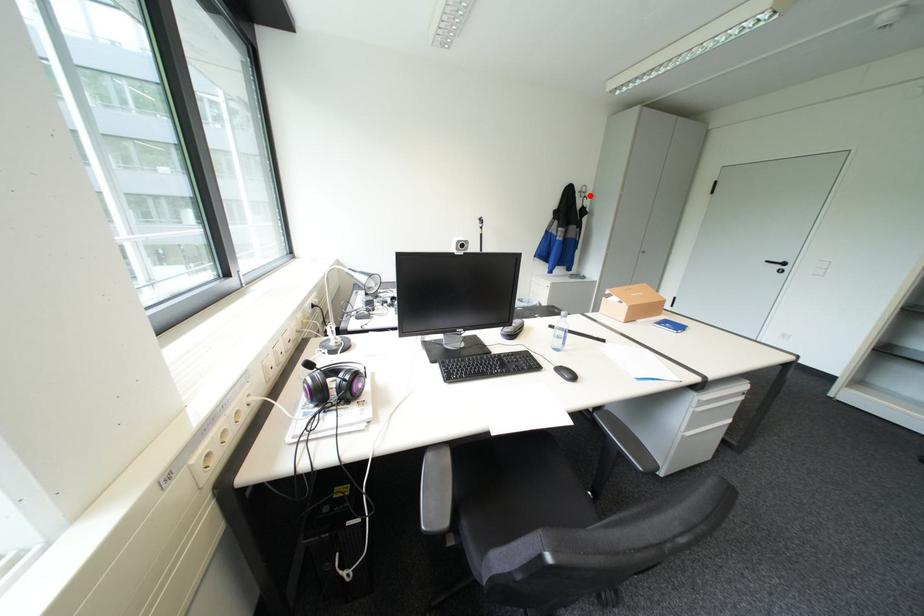
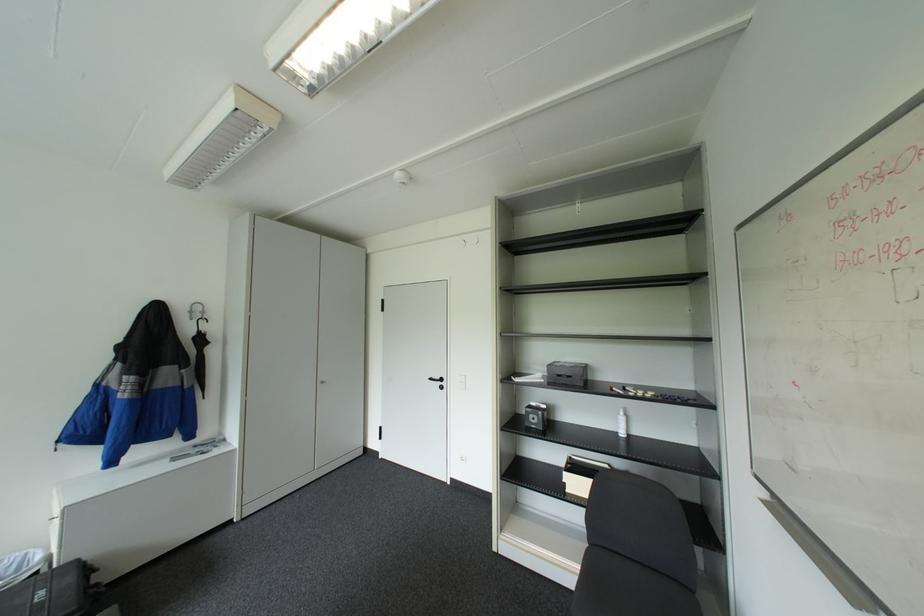
Question: I am providing you with two images of the same scene from different viewpoints. A red point is marked on the first image. Is the red point's position out of view in image 2?

Choices:
 (A) Yes
 (B) No

Answer: (B)